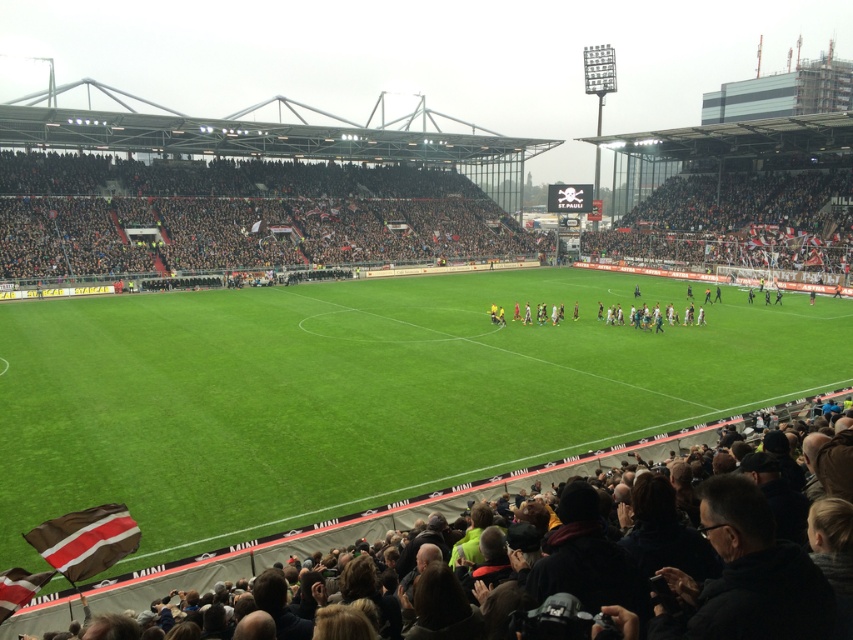
You are a photographer standing at the edge of the soccer field. You want to take a photo of the brown striped fabric at lower left and the striped fabric flag at lower left. Which object should you focus on first if you want to capture both in the frame?

The brown striped fabric at lower left is located above the striped fabric flag at lower left, so you should focus on the brown striped fabric at lower left first to ensure both are in the frame.

You are a drone operator trying to capture aerial footage of the soccer match. Your camera has a field of view that can only focus on objects within a 0.15 unit radius from the center point. If you aim your camera at the dark gray fabric crowd at lower center, will the entire crowd be within the camera frame?

Answer: The dark gray fabric crowd at lower center is located at point (351, 528). Since the camera can only focus on objects within a 0.15 unit radius from the center point, the crowd will be within the frame as long as its entire area is within that radius. However, the description only provides the center point coordinates, so we cannot confirm if the entire crowd fits without knowing its size relative to the radius.